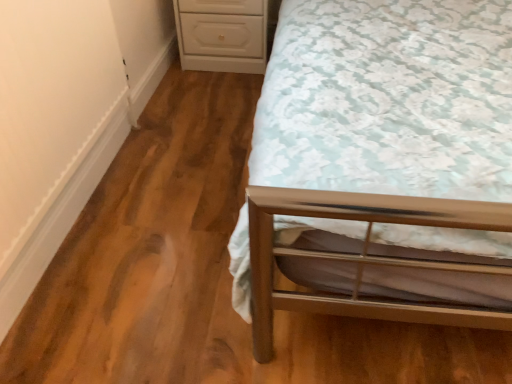
Measure the distance between point (234, 49) and camera.

The distance of point (234, 49) from camera is 2.32 meters.

The height and width of the screenshot is (384, 512). What do you see at coordinates (222, 35) in the screenshot? I see `white glossy chest of drawers at upper center` at bounding box center [222, 35].

What is the approximate width of white glossy chest of drawers at upper center?

It is 53.04 centimeters.

Identify the location of white glossy chest of drawers at upper center. This screenshot has height=384, width=512. (222, 35).

What do you see at coordinates (383, 164) in the screenshot? I see `metallic silver bed at right` at bounding box center [383, 164].

Measure the distance between point (501,200) and camera.

The distance of point (501,200) from camera is 31.46 inches.

The width and height of the screenshot is (512, 384). Identify the location of metallic silver bed at right. (383, 164).

At what (x,y) coordinates should I click in order to perform the action: click on white glossy chest of drawers at upper center. Please return your answer as a coordinate pair (x, y). The width and height of the screenshot is (512, 384). Looking at the image, I should click on (222, 35).

Is white glossy chest of drawers at upper center to the right of metallic silver bed at right from the viewer's perspective?

No, white glossy chest of drawers at upper center is not to the right of metallic silver bed at right.

Is white glossy chest of drawers at upper center positioned behind metallic silver bed at right?

Yes, it is.

Does point (256, 3) come farther from viewer compared to point (457, 92)?

Yes, it is behind point (457, 92).

From the image's perspective, would you say white glossy chest of drawers at upper center is shown under metallic silver bed at right?

No, from the image's perspective, white glossy chest of drawers at upper center is not below metallic silver bed at right.

From a real-world perspective, does white glossy chest of drawers at upper center stand above metallic silver bed at right?

No, from a real-world perspective, white glossy chest of drawers at upper center is not over metallic silver bed at right

Between white glossy chest of drawers at upper center and metallic silver bed at right, which one has larger width?

With larger width is metallic silver bed at right.

Who is taller, white glossy chest of drawers at upper center or metallic silver bed at right?

Standing taller between the two is metallic silver bed at right.

In the scene shown: Is white glossy chest of drawers at upper center smaller than metallic silver bed at right?

Indeed, white glossy chest of drawers at upper center has a smaller size compared to metallic silver bed at right.

Choose the correct answer: Is white glossy chest of drawers at upper center inside metallic silver bed at right or outside it?

white glossy chest of drawers at upper center is not enclosed by metallic silver bed at right.

Is white glossy chest of drawers at upper center next to metallic silver bed at right and touching it?

No.

Is white glossy chest of drawers at upper center aimed at metallic silver bed at right?

No, white glossy chest of drawers at upper center is not aimed at metallic silver bed at right.

Measure the distance between white glossy chest of drawers at upper center and metallic silver bed at right.

white glossy chest of drawers at upper center is 1.06 meters away from metallic silver bed at right.

Find the location of a particular element. The height and width of the screenshot is (384, 512). the chest of drawers that appears behind the metallic silver bed at right is located at coordinates (222, 35).

Is metallic silver bed at right at the right side of white glossy chest of drawers at upper center?

Yes.

Is the position of metallic silver bed at right more distant than that of white glossy chest of drawers at upper center?

No, metallic silver bed at right is closer to the camera.

Is point (440, 238) closer or farther from the camera than point (234, 39)?

Point (440, 238) is positioned closer to the camera compared to point (234, 39).

Looking at this image, from the image's perspective, is metallic silver bed at right above or below white glossy chest of drawers at upper center?

From the image's perspective, metallic silver bed at right appears below white glossy chest of drawers at upper center.

From a real-world perspective, who is located lower, metallic silver bed at right or white glossy chest of drawers at upper center?

white glossy chest of drawers at upper center, from a real-world perspective.

Which object is thinner, metallic silver bed at right or white glossy chest of drawers at upper center?

white glossy chest of drawers at upper center is thinner.

Between metallic silver bed at right and white glossy chest of drawers at upper center, which one has more height?

With more height is metallic silver bed at right.

Considering the relative sizes of metallic silver bed at right and white glossy chest of drawers at upper center in the image provided, is metallic silver bed at right bigger than white glossy chest of drawers at upper center?

Yes.

Can white glossy chest of drawers at upper center be found inside metallic silver bed at right?

No, white glossy chest of drawers at upper center is not a part of metallic silver bed at right.

Is metallic silver bed at right beside white glossy chest of drawers at upper center?

metallic silver bed at right and white glossy chest of drawers at upper center are not in contact.

Looking at this image, is white glossy chest of drawers at upper center at the back of metallic silver bed at right?

No, white glossy chest of drawers at upper center is not at the back of metallic silver bed at right.

How much distance is there between metallic silver bed at right and white glossy chest of drawers at upper center?

A distance of 1.06 meters exists between metallic silver bed at right and white glossy chest of drawers at upper center.

I want to click on chest of drawers to the left of metallic silver bed at right, so click(222, 35).

The height and width of the screenshot is (384, 512). In order to click on chest of drawers on the left of the metallic silver bed at right in this screenshot , I will do (222, 35).

This screenshot has height=384, width=512. Find the location of `chest of drawers behind the metallic silver bed at right`. chest of drawers behind the metallic silver bed at right is located at coordinates (222, 35).